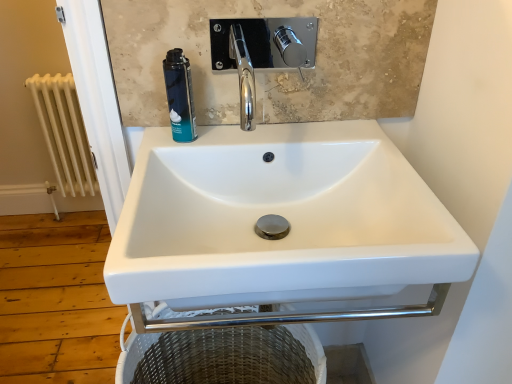
Question: Considering their positions, is white ceramic sink at center located in front of or behind white painted metal radiator at left?

Choices:
 (A) behind
 (B) front

Answer: (B)

Question: Is white ceramic sink at center wider or thinner than white painted metal radiator at left?

Choices:
 (A) wide
 (B) thin

Answer: (A)

Question: Which object is the farthest from the white painted metal radiator at left?

Choices:
 (A) blue matte shaving cream can at upper left
 (B) white ceramic sink at center

Answer: (B)

Question: Which of these objects is positioned farthest from the white ceramic sink at center?

Choices:
 (A) white painted metal radiator at left
 (B) blue matte shaving cream can at upper left

Answer: (A)